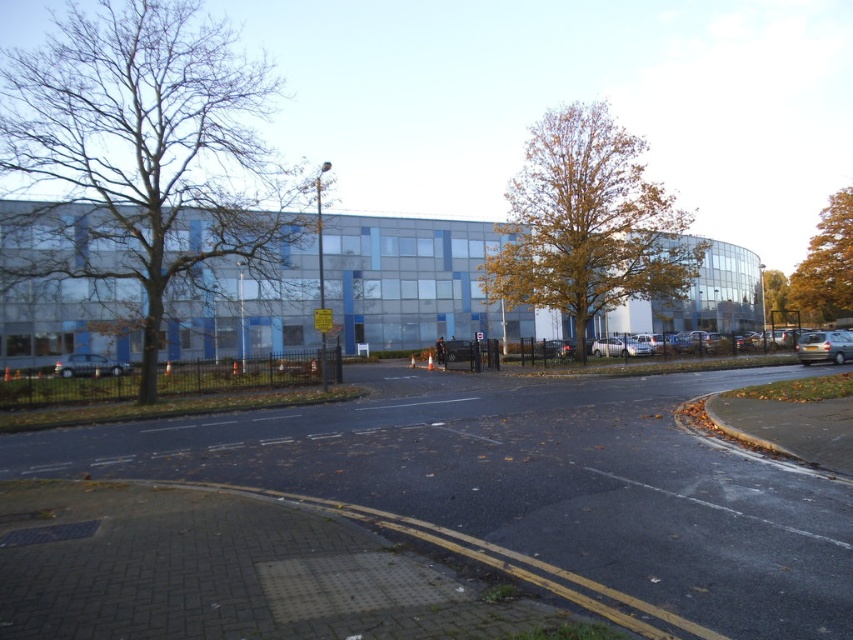
Question: Among these points, which one is farthest from the camera?

Choices:
 (A) (65, 355)
 (B) (763, 280)
 (C) (577, 291)

Answer: (B)

Question: Is brown leafy tree at left to the left of brown leafy tree at center from the viewer's perspective?

Choices:
 (A) yes
 (B) no

Answer: (A)

Question: Which point appears closest to the camera in this image?

Choices:
 (A) (809, 337)
 (B) (846, 264)
 (C) (780, 307)

Answer: (A)

Question: Is yellow leafy tree at upper right bigger than silver metallic car at lower left?

Choices:
 (A) no
 (B) yes

Answer: (B)

Question: Based on their relative distances, which object is farther from the silver metallic car at lower left?

Choices:
 (A) yellow leafy tree at upper right
 (B) brown leafy tree at left

Answer: (A)

Question: Is brown leafy tree at center above silver metallic car at lower left?

Choices:
 (A) yes
 (B) no

Answer: (A)